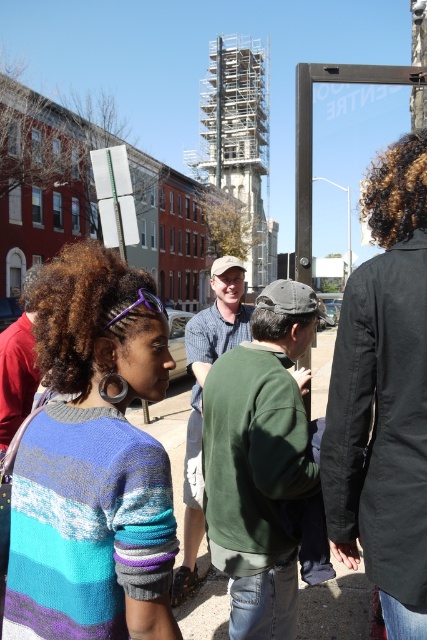
Where is `knitted sweater at center`? Image resolution: width=427 pixels, height=640 pixels. knitted sweater at center is located at coordinates (93, 461).

Between knitted sweater at center and checkered shirt at center, which one appears on the left side from the viewer's perspective?

knitted sweater at center

Find the location of a particular element. The height and width of the screenshot is (640, 427). knitted sweater at center is located at coordinates (93, 461).

Where is `knitted sweater at center`? The width and height of the screenshot is (427, 640). knitted sweater at center is located at coordinates click(x=93, y=461).

Who is more forward, (295, 584) or (227, 316)?

Positioned in front is point (295, 584).

Is green matte sweatshirt at center shorter than checkered shirt at center?

Indeed, green matte sweatshirt at center has a lesser height compared to checkered shirt at center.

Who is more distant from viewer, (257, 593) or (186, 476)?

Point (186, 476)

At what (x,y) coordinates should I click in order to perform the action: click on green matte sweatshirt at center. Please return your answer as a coordinate pair (x, y). The image size is (427, 640). Looking at the image, I should click on (260, 460).

Does knitted sweater at center appear on the left side of green matte sweatshirt at center?

Yes, knitted sweater at center is to the left of green matte sweatshirt at center.

Can you confirm if knitted sweater at center is positioned to the right of green matte sweatshirt at center?

In fact, knitted sweater at center is to the left of green matte sweatshirt at center.

Does point (157, 544) come farther from viewer compared to point (266, 353)?

No, it is in front of (266, 353).

The width and height of the screenshot is (427, 640). In order to click on knitted sweater at center in this screenshot , I will do `click(93, 461)`.